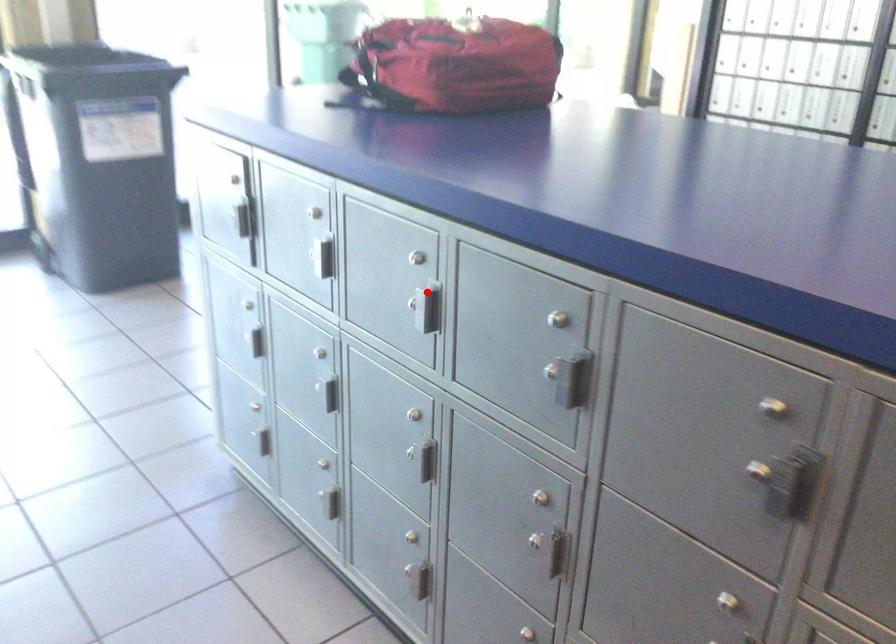
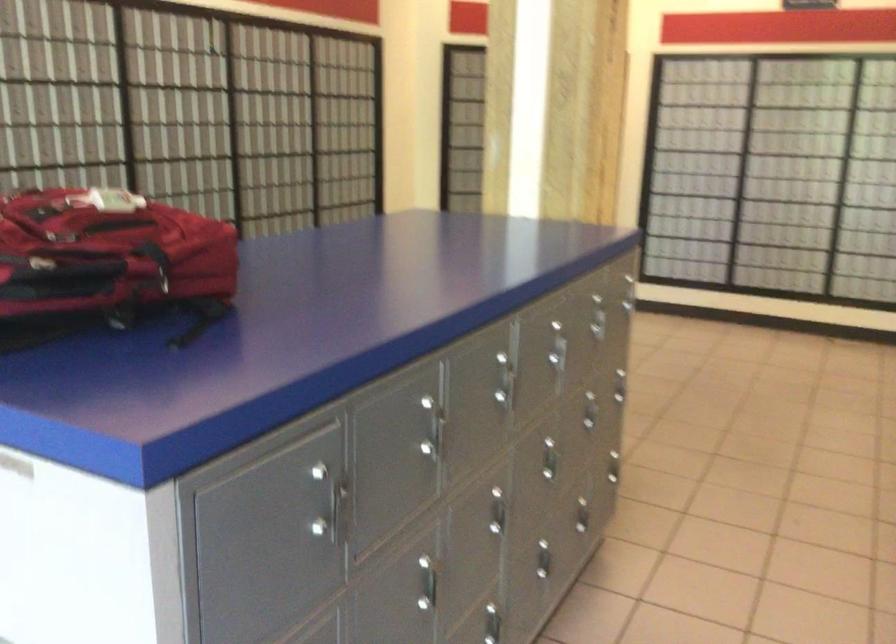
Question: I am providing you with two images of the same scene from different viewpoints. Given a red point in image1, look at the same physical point in image2. Is it:

Choices:
 (A) Closer to the viewpoint
 (B) Farther from the viewpoint

Answer: (B)